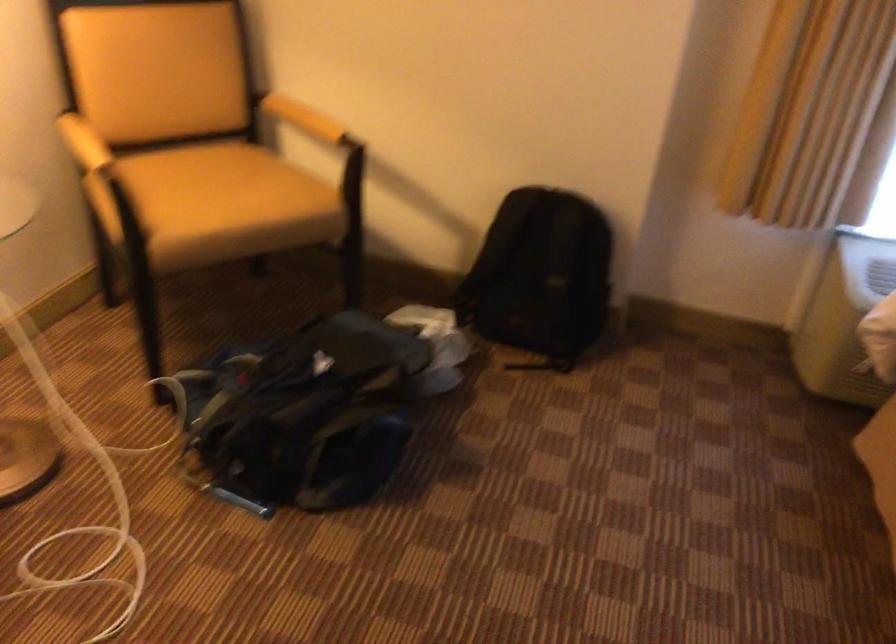
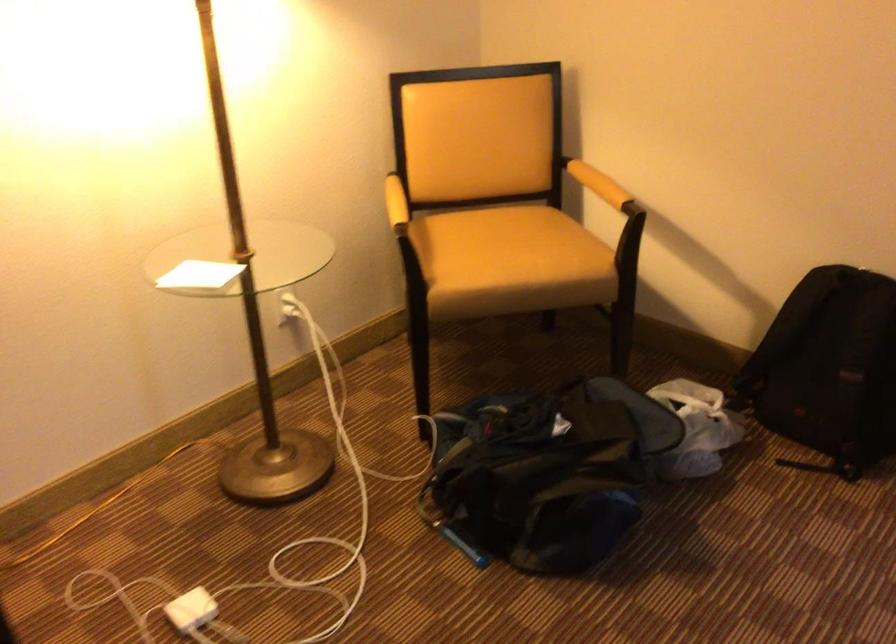
In the second image, find the point that corresponds to point (538, 283) in the first image.

(829, 368)